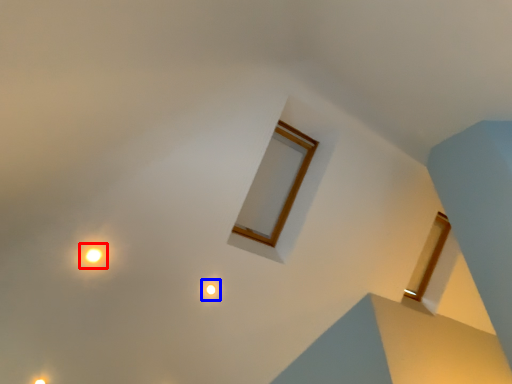
Question: Which object appears farthest to the camera in this image, light (highlighted by a red box) or light (highlighted by a blue box)?

Choices:
 (A) light
 (B) light

Answer: (B)